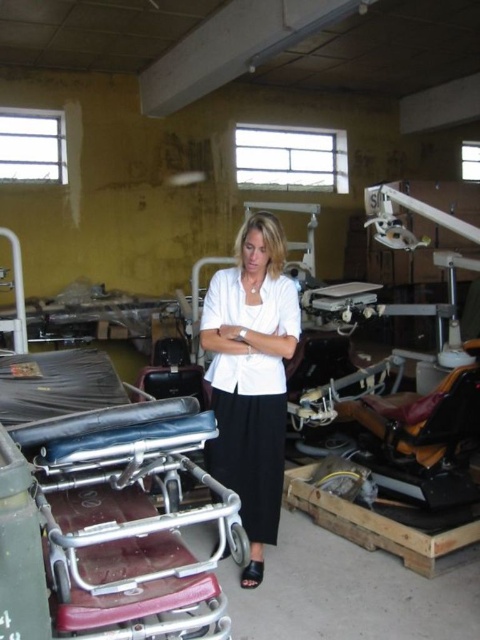
You are a delivery person trying to bring a new medical cart into the storage area. The entrance door is narrow and only allows items up to the width of the white matte shirt at center to pass through. Can the metallic maroon hospital bed at lower left fit through the door?

The metallic maroon hospital bed at lower left might be wider than the white matte shirt at center, so it may not fit through the door which has a width limit based on the shirt.

You are a delivery person who needs to place a package between the metallic maroon hospital bed at lower left and the white matte shirt at center. The package requires a minimum of 1 meter of space. Can you fit it there?

The distance between the metallic maroon hospital bed at lower left and the white matte shirt at center is 84.26 centimeters. Since the required space is 1 meter, the package cannot be placed there as the available space is insufficient.